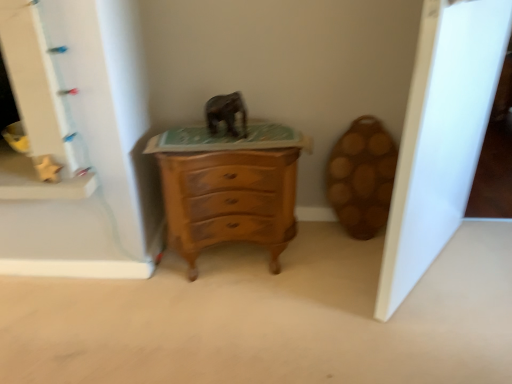
Locate an element on the screen. This screenshot has width=512, height=384. wooden chest of drawers at center is located at coordinates (229, 187).

Describe the element at coordinates (441, 136) in the screenshot. I see `white glossy door at right` at that location.

The height and width of the screenshot is (384, 512). Identify the location of matte gray elephant at center. (226, 113).

Find the location of a particular element. This screenshot has height=384, width=512. wooden chest of drawers at center is located at coordinates (229, 187).

Can we say matte gray elephant at center lies outside white glossy door at right?

Absolutely, matte gray elephant at center is external to white glossy door at right.

Looking at the image, does matte gray elephant at center seem bigger or smaller compared to white glossy door at right?

Considering their sizes, matte gray elephant at center takes up less space than white glossy door at right.

Considering the sizes of matte gray elephant at center and white glossy door at right in the image, is matte gray elephant at center taller or shorter than white glossy door at right?

matte gray elephant at center is shorter than white glossy door at right.

From a real-world perspective, which object stands above the other?

matte gray elephant at center.

Based on their sizes in the image, would you say white glossy door at right is bigger or smaller than matte gray elephant at center?

Clearly, white glossy door at right is larger in size than matte gray elephant at center.

From the image's perspective, relative to matte gray elephant at center, is white glossy door at right above or below?

From the image's perspective, white glossy door at right appears below matte gray elephant at center.

From a real-world perspective, is white glossy door at right physically below matte gray elephant at center?

Correct, in the physical world, white glossy door at right is lower than matte gray elephant at center.

Between white glossy door at right and matte gray elephant at center, which one appears on the right side from the viewer's perspective?

white glossy door at right.

Is wooden chest of drawers at center taller than matte gray elephant at center?

Yes.

Consider the image. Which of these two, wooden chest of drawers at center or matte gray elephant at center, is bigger?

With larger size is wooden chest of drawers at center.

Looking at this image, are wooden chest of drawers at center and matte gray elephant at center making contact?

No, wooden chest of drawers at center is not making contact with matte gray elephant at center.

Locate an element on the screen. This screenshot has height=384, width=512. animal above the wooden chest of drawers at center (from a real-world perspective) is located at coordinates (226, 113).

Does matte gray elephant at center turn towards wooden chest of drawers at center?

No, matte gray elephant at center is not oriented towards wooden chest of drawers at center.

Is matte gray elephant at center bigger or smaller than wooden chest of drawers at center?

Clearly, matte gray elephant at center is smaller in size than wooden chest of drawers at center.

Is matte gray elephant at center closer to camera compared to wooden chest of drawers at center?

That is False.

Is matte gray elephant at center inside the boundaries of wooden chest of drawers at center, or outside?

matte gray elephant at center is not enclosed by wooden chest of drawers at center.

From the picture: Is wooden chest of drawers at center located outside white glossy door at right?

That's correct, wooden chest of drawers at center is outside of white glossy door at right.

At what (x,y) coordinates should I click in order to perform the action: click on glass door to the right of wooden chest of drawers at center. Please return your answer as a coordinate pair (x, y). This screenshot has width=512, height=384. Looking at the image, I should click on (441, 136).

Can you confirm if wooden chest of drawers at center is wider than white glossy door at right?

Indeed, wooden chest of drawers at center has a greater width compared to white glossy door at right.

Is white glossy door at right facing away from wooden chest of drawers at center?

Yes, white glossy door at right's orientation is away from wooden chest of drawers at center.

From the image's perspective, is white glossy door at right over wooden chest of drawers at center?

Indeed, from the image's perspective, white glossy door at right is shown above wooden chest of drawers at center.

Looking at this image, between white glossy door at right and wooden chest of drawers at center, which one has larger size?

With larger size is white glossy door at right.

Locate an element on the screen. This screenshot has width=512, height=384. glass door that appears in front of the matte gray elephant at center is located at coordinates (441, 136).

The image size is (512, 384). Find the location of `glass door located underneath the matte gray elephant at center (from a real-world perspective)`. glass door located underneath the matte gray elephant at center (from a real-world perspective) is located at coordinates (441, 136).

Based on their spatial positions, is white glossy door at right or wooden chest of drawers at center closer to matte gray elephant at center?

wooden chest of drawers at center lies closer to matte gray elephant at center than the other object.

Considering their positions, is white glossy door at right positioned further to wooden chest of drawers at center than matte gray elephant at center?

Among the two, white glossy door at right is located further to wooden chest of drawers at center.

Based on their spatial positions, is matte gray elephant at center or wooden chest of drawers at center closer to white glossy door at right?

Based on the image, wooden chest of drawers at center appears to be nearer to white glossy door at right.

Based on their spatial positions, is wooden chest of drawers at center or white glossy door at right closer to matte gray elephant at center?

The object closer to matte gray elephant at center is wooden chest of drawers at center.

Based on their spatial positions, is wooden chest of drawers at center or matte gray elephant at center closer to white glossy door at right?

wooden chest of drawers at center.

When comparing their distances from wooden chest of drawers at center, does matte gray elephant at center or white glossy door at right seem closer?

matte gray elephant at center is closer to wooden chest of drawers at center.

The image size is (512, 384). I want to click on chest of drawers between matte gray elephant at center and white glossy door at right from left to right, so point(229,187).